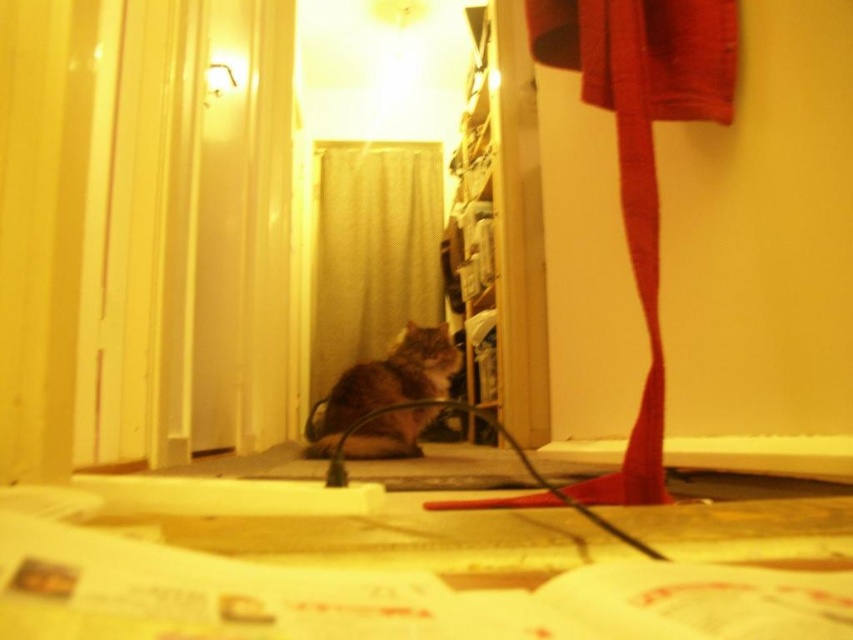
Question: Does white textured curtain at center have a larger size compared to tabby fur cat at center?

Choices:
 (A) yes
 (B) no

Answer: (A)

Question: Which point is farther to the camera?

Choices:
 (A) white textured curtain at center
 (B) tabby fur cat at center

Answer: (A)

Question: Is white textured curtain at center thinner than tabby fur cat at center?

Choices:
 (A) no
 (B) yes

Answer: (A)

Question: Which point appears closest to the camera in this image?

Choices:
 (A) (343, 452)
 (B) (376, 353)

Answer: (A)

Question: From the image, what is the correct spatial relationship of white textured curtain at center in relation to tabby fur cat at center?

Choices:
 (A) below
 (B) above

Answer: (B)